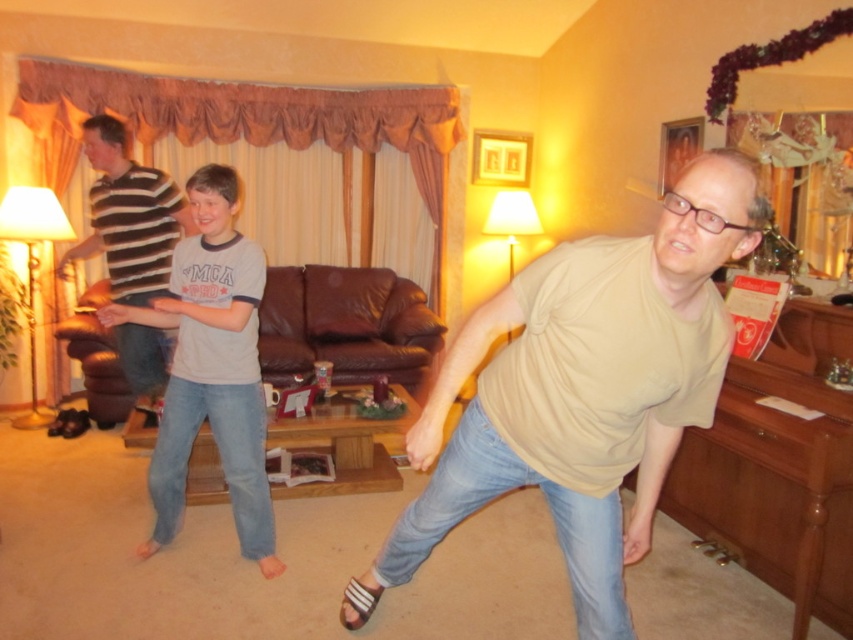
Is gray cotton shirt at center to the left of striped cotton shirt at left from the viewer's perspective?

No, gray cotton shirt at center is not to the left of striped cotton shirt at left.

Between gray cotton shirt at center and striped cotton shirt at left, which one appears on the right side from the viewer's perspective?

gray cotton shirt at center

Which is behind, point (210, 417) or point (141, 269)?

Point (141, 269)

Identify the location of gray cotton shirt at center. This screenshot has height=640, width=853. (212, 368).

Does point (579, 432) lie behind point (129, 374)?

No, it is not.

Is matte beige t-shirt at center below striped cotton shirt at left?

Yes.

What are the coordinates of `matte beige t-shirt at center` in the screenshot? It's located at (583, 392).

Between matte beige t-shirt at center and gray cotton shirt at center, which one appears on the left side from the viewer's perspective?

gray cotton shirt at center

Between point (579, 458) and point (178, 384), which one is positioned behind?

The point (178, 384) is behind.

Image resolution: width=853 pixels, height=640 pixels. In order to click on matte beige t-shirt at center in this screenshot , I will do `click(583, 392)`.